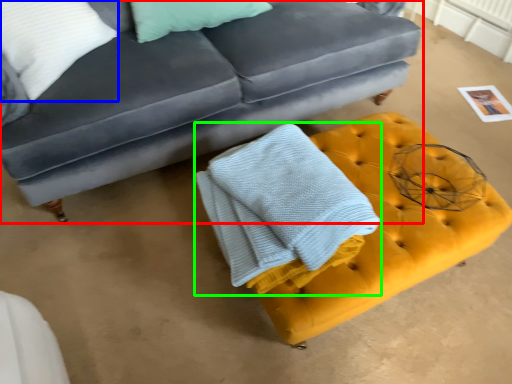
Question: Based on their relative distances, which object is farther from studio couch (highlighted by a red box)? Choose from pillow (highlighted by a blue box) and bath towel (highlighted by a green box).

Choices:
 (A) pillow
 (B) bath towel

Answer: (B)